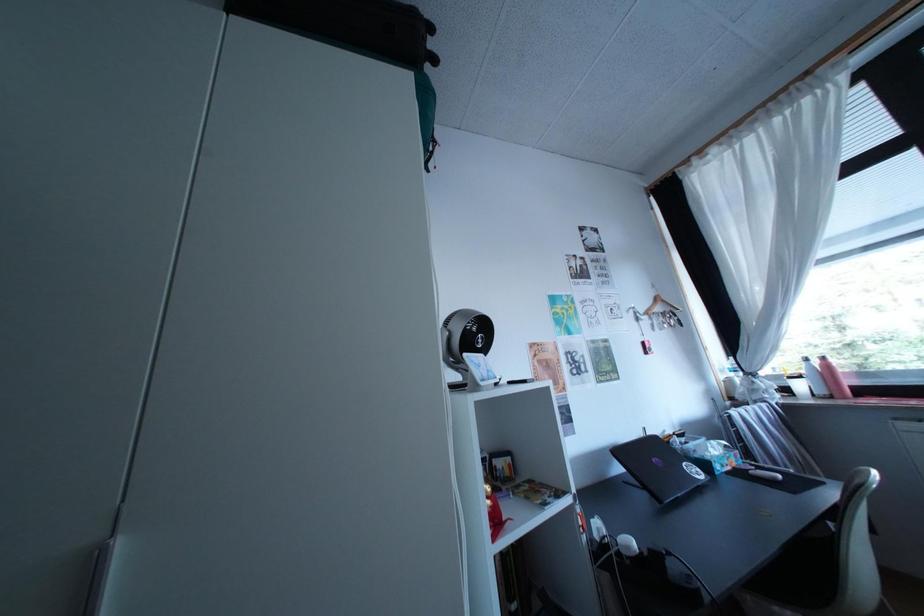
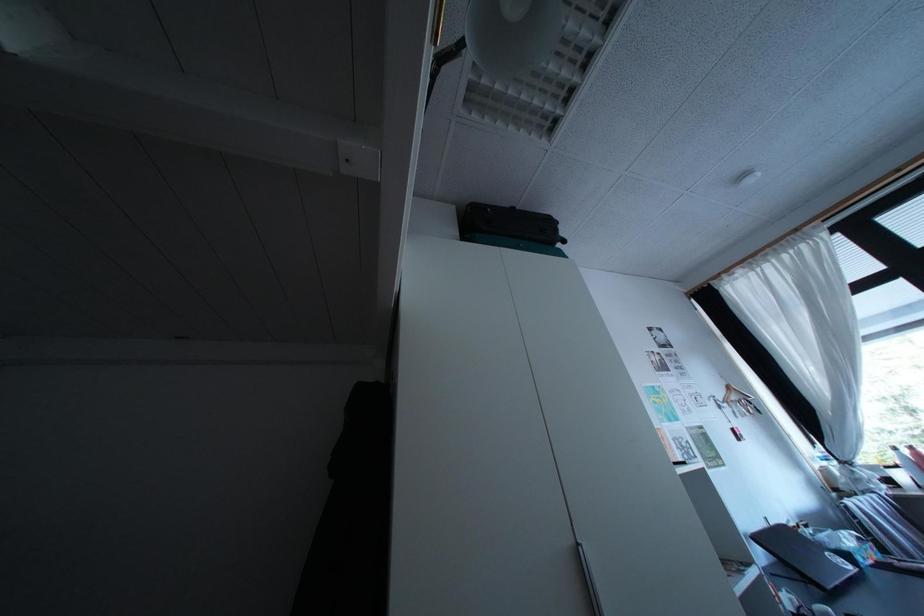
Question: How did the camera likely rotate?

Choices:
 (A) Left
 (B) Right
 (C) Up
 (D) Down

Answer: (C)